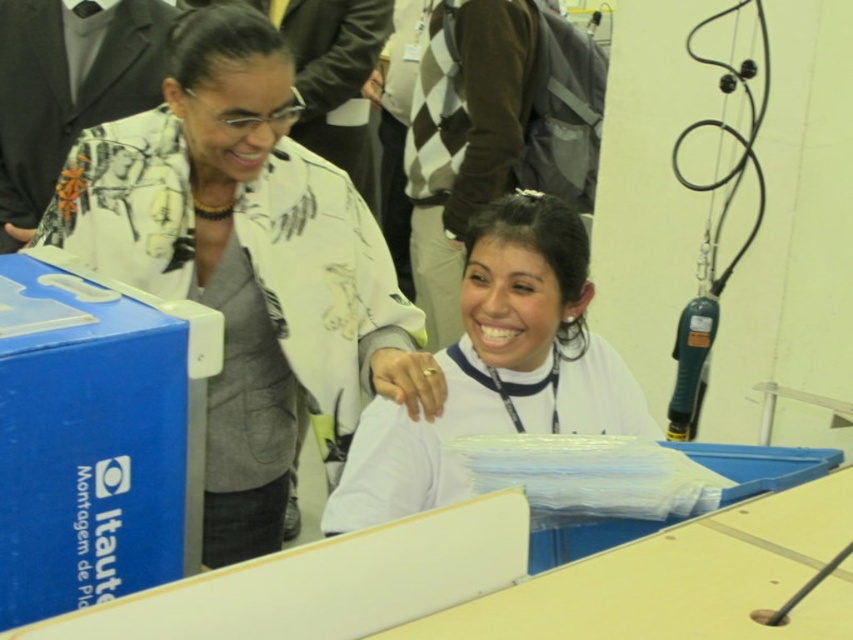
Can you confirm if blue plastic box at lower left is bigger than white matte shirt at center?

No.

Is blue plastic box at lower left behind white matte shirt at center?

No, it is in front of white matte shirt at center.

Does point (71, 544) come behind point (384, 445)?

No, (71, 544) is closer to viewer.

You are a GUI agent. You are given a task and a screenshot of the screen. Output one action in this format:
    pyautogui.click(x=<x>, y=<y>)
    Task: Click on the blue plastic box at lower left
    
    Given the screenshot: What is the action you would take?
    pyautogui.click(x=96, y=436)